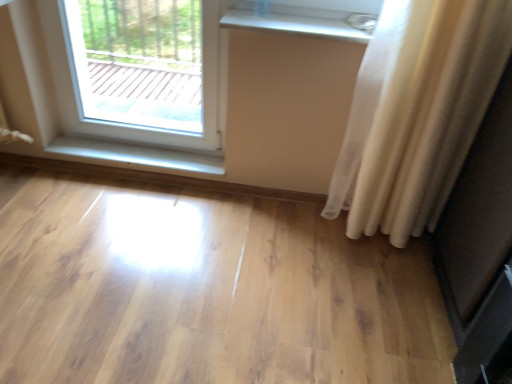
Question: Is matte black screen door at right with white glossy radiator at upper center, the first window sill positioned from the right?

Choices:
 (A) no
 (B) yes

Answer: (A)

Question: Is matte black screen door at right positioned far away from white glossy radiator at upper center, marked as the 2th window sill in a left-to-right arrangement?

Choices:
 (A) yes
 (B) no

Answer: (B)

Question: Does matte black screen door at right have a smaller size compared to white glossy radiator at upper center, positioned as the second window sill in back-to-front order?

Choices:
 (A) yes
 (B) no

Answer: (B)

Question: Considering the relative positions of matte black screen door at right and white glossy radiator at upper center, the first window sill positioned from the right, in the image provided, is matte black screen door at right to the right of white glossy radiator at upper center, the first window sill positioned from the right, from the viewer's perspective?

Choices:
 (A) yes
 (B) no

Answer: (A)

Question: Does matte black screen door at right have a greater width compared to white glossy radiator at upper center, the first window sill positioned from the right?

Choices:
 (A) no
 (B) yes

Answer: (B)

Question: From their relative heights in the image, would you say white sheer curtain at right is taller or shorter than matte black screen door at right?

Choices:
 (A) short
 (B) tall

Answer: (B)

Question: Does point (380, 195) appear closer or farther from the camera than point (510, 145)?

Choices:
 (A) farther
 (B) closer

Answer: (A)

Question: Is white sheer curtain at right situated inside matte black screen door at right or outside?

Choices:
 (A) inside
 (B) outside

Answer: (B)

Question: Considering the positions of white sheer curtain at right and matte black screen door at right in the image, is white sheer curtain at right wider or thinner than matte black screen door at right?

Choices:
 (A) wide
 (B) thin

Answer: (B)

Question: From the image's perspective, is light wood floor at center positioned above or below white glossy wood at lower left, which appears as the 1th window sill when viewed from the back?

Choices:
 (A) above
 (B) below

Answer: (B)

Question: Does point (436, 312) appear closer or farther from the camera than point (159, 157)?

Choices:
 (A) closer
 (B) farther

Answer: (A)

Question: Is light wood floor at center in front of or behind white glossy wood at lower left, the first window sill ordered from the bottom, in the image?

Choices:
 (A) behind
 (B) front

Answer: (B)

Question: From their relative heights in the image, would you say light wood floor at center is taller or shorter than white glossy wood at lower left, which appears as the 1th window sill when viewed from the back?

Choices:
 (A) short
 (B) tall

Answer: (B)

Question: From a real-world perspective, is light wood floor at center physically located above or below white glossy radiator at upper center, the second window sill when ordered from bottom to top?

Choices:
 (A) below
 (B) above

Answer: (A)

Question: Which is correct: light wood floor at center is inside white glossy radiator at upper center, the first window sill positioned from the right, or outside of it?

Choices:
 (A) outside
 (B) inside

Answer: (A)